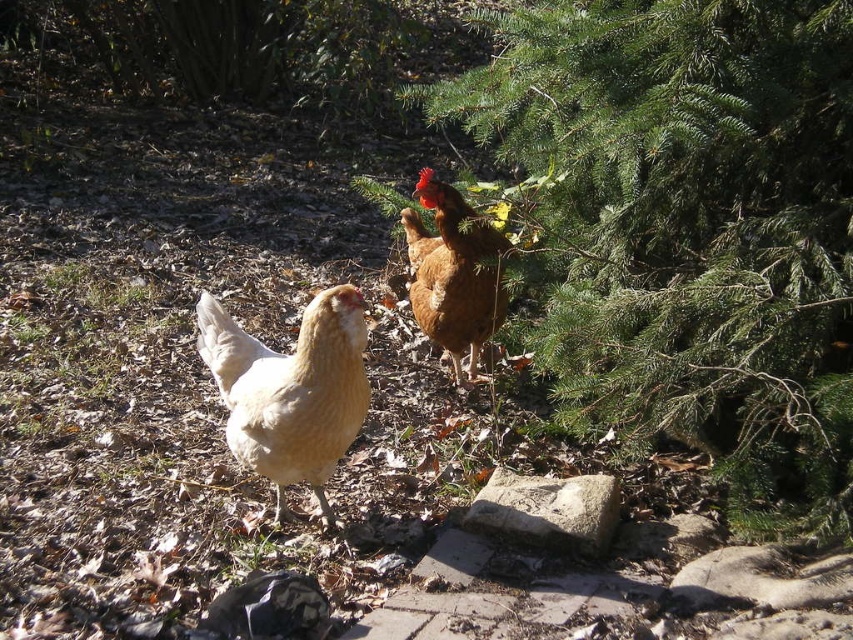
Question: Is light brown feathered chicken at center smaller than brown matte chicken at upper center?

Choices:
 (A) yes
 (B) no

Answer: (A)

Question: Which point is closer to the camera?

Choices:
 (A) (368, 394)
 (B) (486, 237)
 (C) (666, 138)

Answer: (C)

Question: Is green needle-like leaves at upper right behind brown matte chicken at upper center?

Choices:
 (A) no
 (B) yes

Answer: (A)

Question: Does green needle-like leaves at upper right appear over brown matte chicken at upper center?

Choices:
 (A) yes
 (B) no

Answer: (A)

Question: Which object is closer to the camera taking this photo?

Choices:
 (A) light brown feathered chicken at center
 (B) green needle-like leaves at upper right

Answer: (B)

Question: Which object is farther from the camera taking this photo?

Choices:
 (A) light brown feathered chicken at center
 (B) green needle-like leaves at upper right
 (C) brown matte chicken at upper center

Answer: (C)